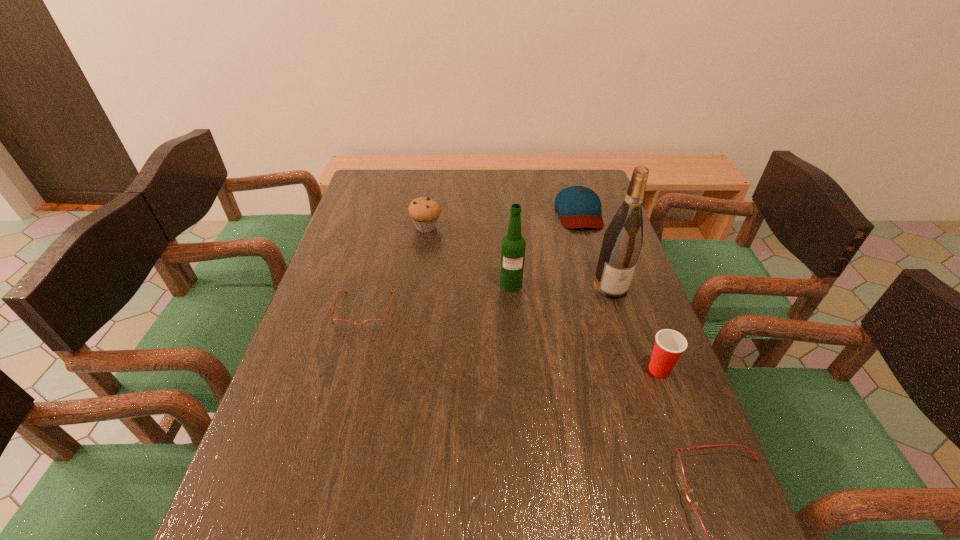
Please point a space for a new spectacles to maintain equal intervals. Please provide its 2D coordinates. Your answer should be formatted as a tuple, i.e. [(x, y)], where the tuple contains the x and y coordinates of a point satisfying the conditions above.

[(514, 389)]